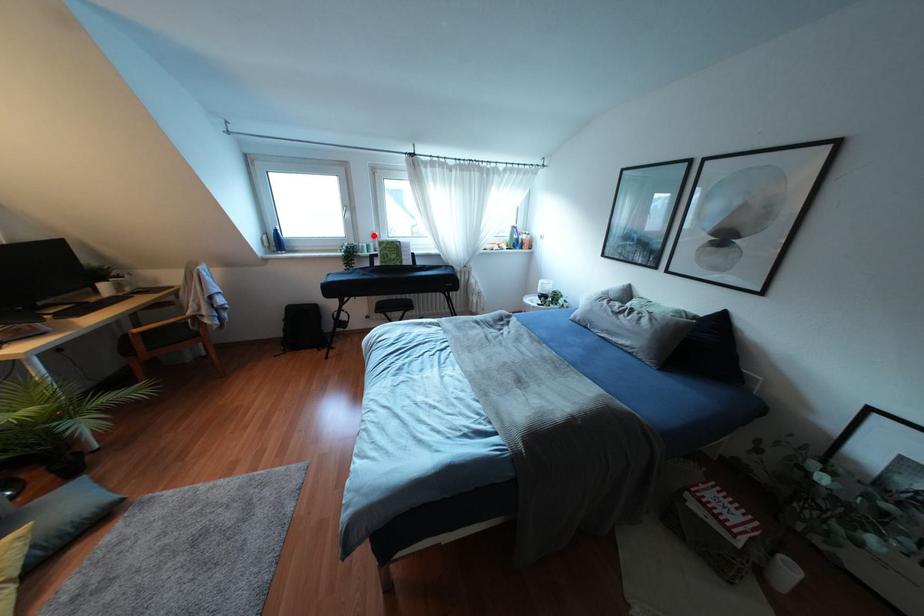
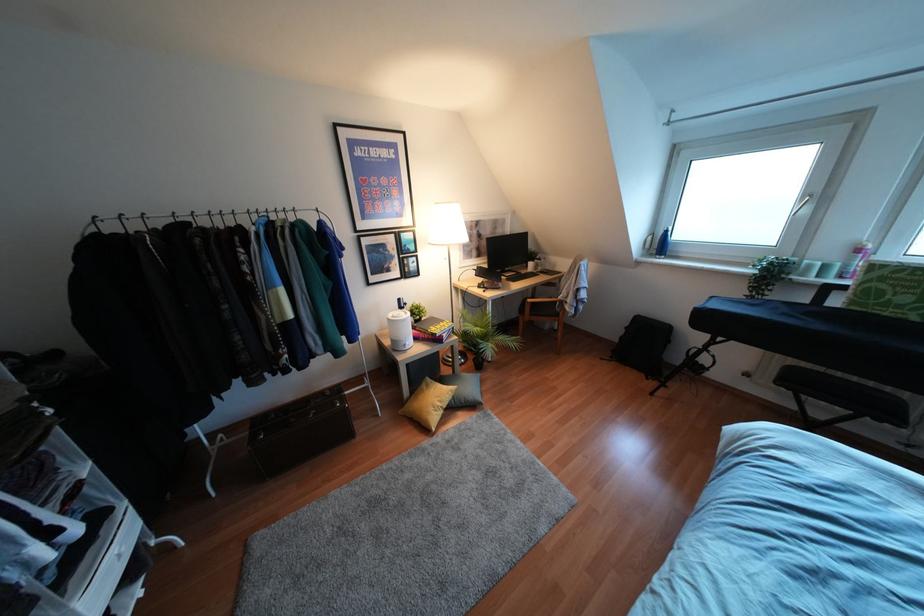
Question: I am providing you with two images of the same scene from different viewpoints. Given a red point in image1, look at the same physical point in image2. Is it:

Choices:
 (A) Closer to the viewpoint
 (B) Farther from the viewpoint

Answer: (B)